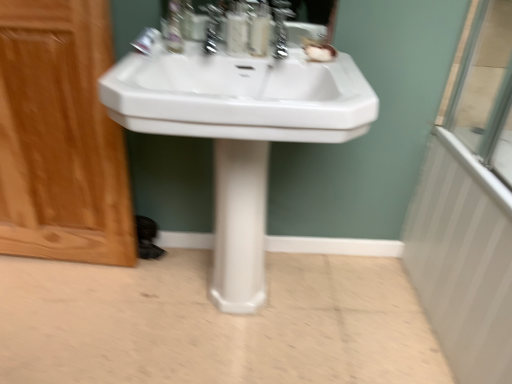
Question: From a real-world perspective, does white glossy sink at center sit lower than translucent plastic soap dispenser at center, positioned as the 1th soap dispenser in left-to-right order?

Choices:
 (A) no
 (B) yes

Answer: (B)

Question: Is the position of white glossy sink at center more distant than that of translucent plastic soap dispenser at center, positioned as the 1th soap dispenser in left-to-right order?

Choices:
 (A) no
 (B) yes

Answer: (A)

Question: Does white glossy sink at center turn towards translucent plastic soap dispenser at center, positioned as the 1th soap dispenser in left-to-right order?

Choices:
 (A) yes
 (B) no

Answer: (B)

Question: From the image's perspective, would you say white glossy sink at center is shown under translucent plastic soap dispenser at center, positioned as the 1th soap dispenser in left-to-right order?

Choices:
 (A) yes
 (B) no

Answer: (A)

Question: From the image's perspective, is white glossy sink at center above translucent plastic soap dispenser at center, positioned as the 1th soap dispenser in left-to-right order?

Choices:
 (A) no
 (B) yes

Answer: (A)

Question: From a real-world perspective, does white glossy sink at center stand above translucent plastic soap dispenser at center, positioned as the second soap dispenser in right-to-left order?

Choices:
 (A) yes
 (B) no

Answer: (B)

Question: From the image's perspective, is white glossy sink at center over satin nickel faucet at upper center, which is the first faucet in right-to-left order?

Choices:
 (A) yes
 (B) no

Answer: (B)

Question: Considering the relative sizes of white glossy sink at center and satin nickel faucet at upper center, which is the first faucet in right-to-left order, in the image provided, is white glossy sink at center bigger than satin nickel faucet at upper center, which is the first faucet in right-to-left order,?

Choices:
 (A) yes
 (B) no

Answer: (A)

Question: Could you tell me if white glossy sink at center is facing satin nickel faucet at upper center, which is the first faucet in right-to-left order?

Choices:
 (A) yes
 (B) no

Answer: (B)

Question: Can you confirm if white glossy sink at center is wider than satin nickel faucet at upper center, which is the first faucet in right-to-left order?

Choices:
 (A) no
 (B) yes

Answer: (B)

Question: Is white glossy sink at center looking in the opposite direction of satin nickel faucet at upper center, which is the first faucet in right-to-left order?

Choices:
 (A) yes
 (B) no

Answer: (B)

Question: From a real-world perspective, is white glossy sink at center below satin nickel faucet at upper center, which is the first faucet in right-to-left order?

Choices:
 (A) no
 (B) yes

Answer: (B)

Question: Can you confirm if translucent plastic soap dispenser at center, positioned as the second soap dispenser in right-to-left order, is positioned to the left of white textured radiator at right?

Choices:
 (A) no
 (B) yes

Answer: (B)